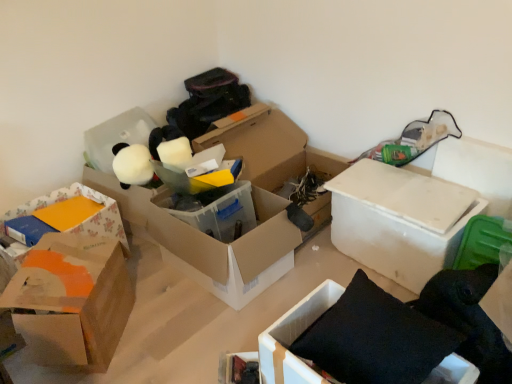
Question: Would you say translucent plastic box at center, placed as the 3th box when sorted from right to left, is inside or outside orange cardboard box at left, which appears as the 4th box when viewed from the right?

Choices:
 (A) inside
 (B) outside

Answer: (B)

Question: Considering their positions, is translucent plastic box at center, placed as the 3th box when sorted from right to left, located in front of or behind orange cardboard box at left, which appears as the 4th box when viewed from the right?

Choices:
 (A) behind
 (B) front

Answer: (A)

Question: Which is nearer to the white cardboard box at center-right, the first box in the right-to-left sequence?

Choices:
 (A) white matte stuffed animal at upper left, arranged as the 2th storage box when viewed from the right
 (B) translucent plastic box at center, placed as the third box when sorted from left to right
 (C) black fabric cushion at lower right, the second box positioned from the right
 (D) matte black book at lower center, the second storage box from the back
 (E) floral paper box at left, marked as the 5th box in a right-to-left arrangement

Answer: (B)

Question: Which is nearer to the white matte stuffed animal at upper left, placed as the first storage box when sorted from back to front?

Choices:
 (A) black fabric cushion at lower right, the second box positioned from the right
 (B) orange cardboard box at left, the second box in the left-to-right sequence
 (C) matte black book at lower center, the first storage box viewed from the front
 (D) floral paper box at left, which is the first box in left-to-right order
 (E) white cardboard box at center-right, the fifth box when ordered from left to right

Answer: (D)